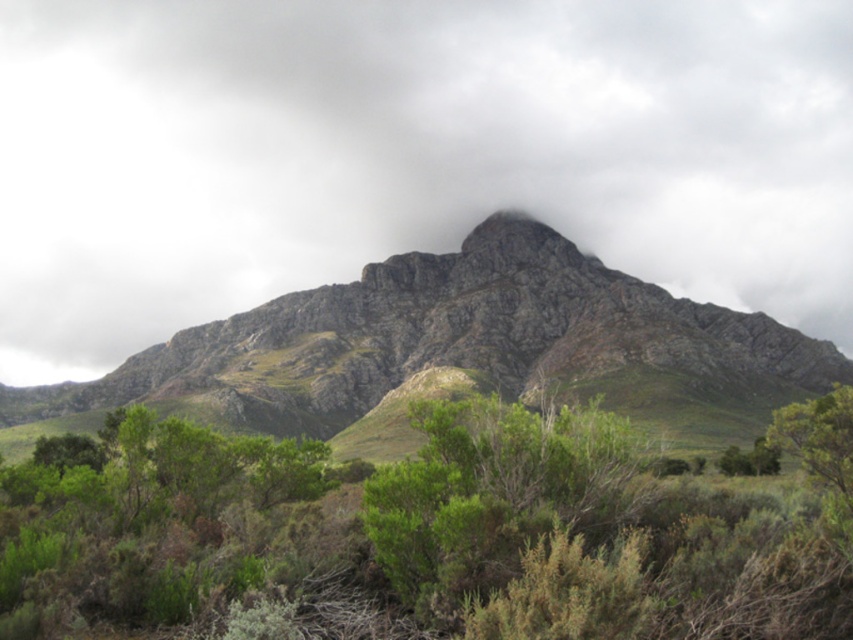
Does white fluffy cloud at center have a larger size compared to rugged rock mountain at center?

Correct, white fluffy cloud at center is larger in size than rugged rock mountain at center.

Does white fluffy cloud at center come in front of rugged rock mountain at center?

No, it is not.

What do you see at coordinates (407, 154) in the screenshot?
I see `white fluffy cloud at center` at bounding box center [407, 154].

At what (x,y) coordinates should I click in order to perform the action: click on white fluffy cloud at center. Please return your answer as a coordinate pair (x, y). Looking at the image, I should click on (407, 154).

Does white fluffy cloud at center have a lesser height compared to green leafy shrub at center?

No, white fluffy cloud at center is not shorter than green leafy shrub at center.

How much distance is there between white fluffy cloud at center and green leafy shrub at center?

white fluffy cloud at center and green leafy shrub at center are 299.85 meters apart.

Image resolution: width=853 pixels, height=640 pixels. I want to click on white fluffy cloud at center, so click(x=407, y=154).

Is rugged rock mountain at center further to the viewer compared to green leafy shrub at center?

Yes, it is behind green leafy shrub at center.

Is point (219, 396) in front of point (569, 497)?

No, it is behind (569, 497).

This screenshot has height=640, width=853. I want to click on rugged rock mountain at center, so click(x=456, y=349).